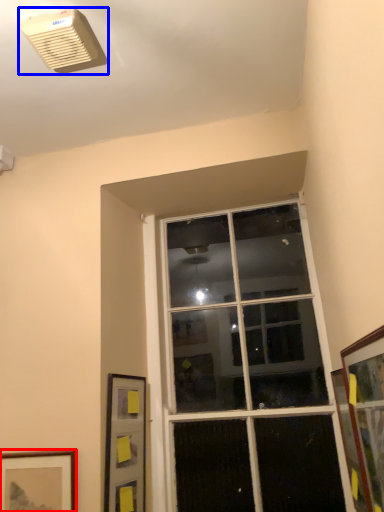
Question: Which object appears farthest to the camera in this image, picture frame (highlighted by a red box) or air conditioning (highlighted by a blue box)?

Choices:
 (A) picture frame
 (B) air conditioning

Answer: (A)